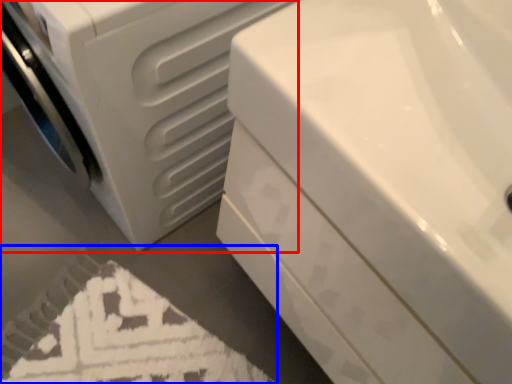
Question: Which point is closer to the camera, washing machine (highlighted by a red box) or bath mat (highlighted by a blue box)?

Choices:
 (A) washing machine
 (B) bath mat

Answer: (A)